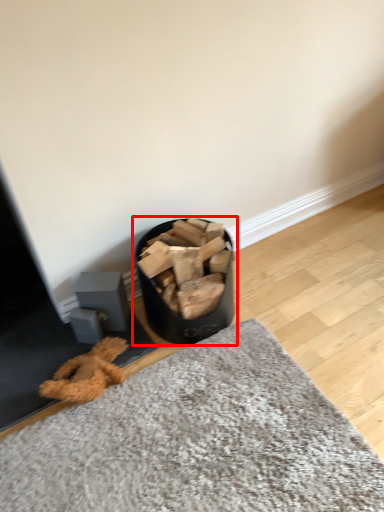
Question: Observing the image, what is the correct spatial positioning of waste container (annotated by the red box) in reference to mat?

Choices:
 (A) left
 (B) right

Answer: (A)